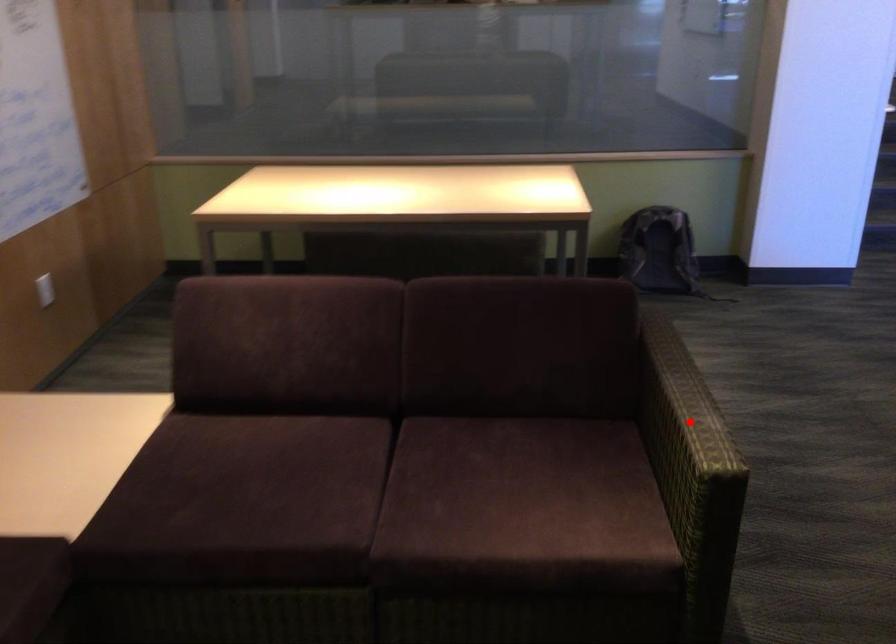
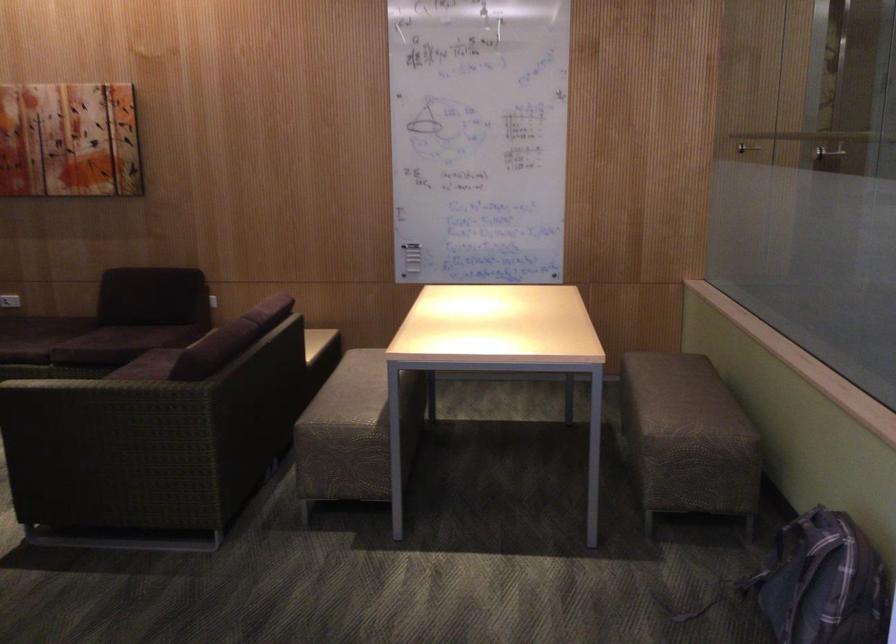
Question: I am providing you with two images of the same scene from different viewpoints. Given a red point in image1, look at the same physical point in image2. Is it:

Choices:
 (A) Closer to the viewpoint
 (B) Farther from the viewpoint

Answer: (B)